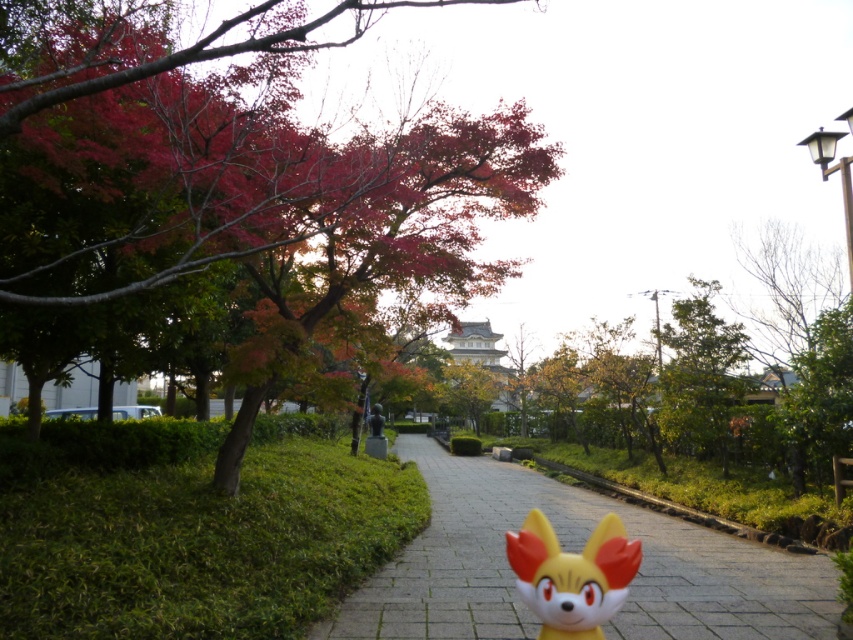
You are standing at the entrance of the park and want to reach the traditional Japanese castle or temple in the distance. According to the image, where should you walk to follow the paved stone path at center?

You should walk towards the paved stone path at center located at point (575, 548) to reach the traditional Japanese castle or temple in the distance.

You are planning to install a new lighting system along the paved stone path at center and the green leafy tree at upper right. Since you want the lights to be visible from the ground level, which object should have shorter lights installed?

The paved stone path at center has a lesser height compared to the green leafy tree at upper right, so shorter lights should be installed on the paved stone path at center to ensure visibility from ground level.